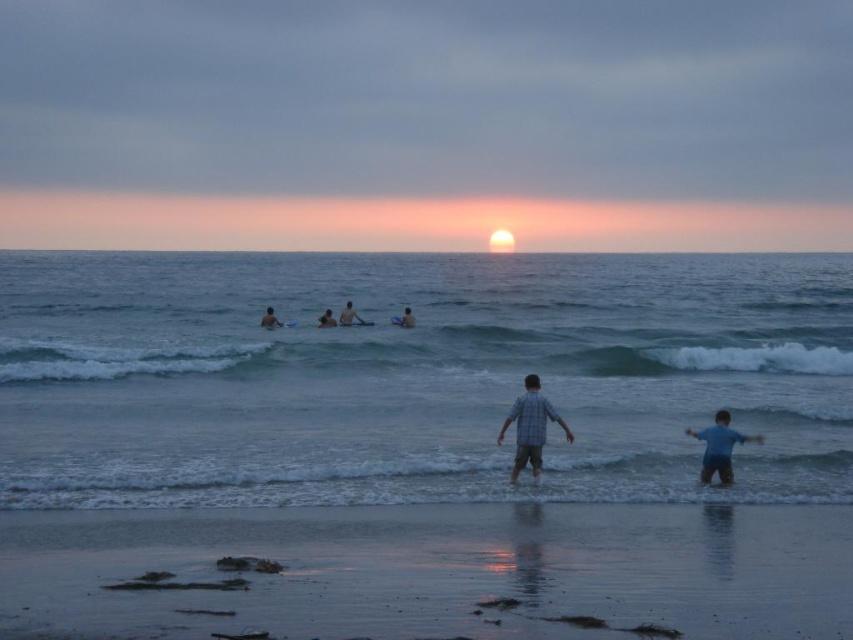
Can you confirm if blue cotton shirt at lower right is positioned to the left of smooth tan skin at center?

Answer: In fact, blue cotton shirt at lower right is to the right of smooth tan skin at center.

Does blue cotton shirt at lower right come in front of smooth tan skin at center?

Yes, blue cotton shirt at lower right is in front of smooth tan skin at center.

Which is behind, point (733, 440) or point (341, 312)?

Positioned behind is point (341, 312).

This screenshot has width=853, height=640. Identify the location of blue cotton shirt at lower right. (718, 448).

Is point (18, 522) positioned after point (270, 317)?

No.

Can you confirm if smooth sand at lower center is taller than smooth skin person at center?

No.

Is point (473, 628) behind point (271, 324)?

That is False.

Identify the location of smooth sand at lower center. The width and height of the screenshot is (853, 640). (438, 570).

Which of these two, clear blue water at center or plaid shirt at center, stands taller?

clear blue water at center is taller.

Is clear blue water at center below plaid shirt at center?

No, clear blue water at center is not below plaid shirt at center.

Between point (782, 403) and point (537, 378), which one is positioned behind?

The point (782, 403) is behind.

Image resolution: width=853 pixels, height=640 pixels. What are the coordinates of `clear blue water at center` in the screenshot? It's located at (415, 376).